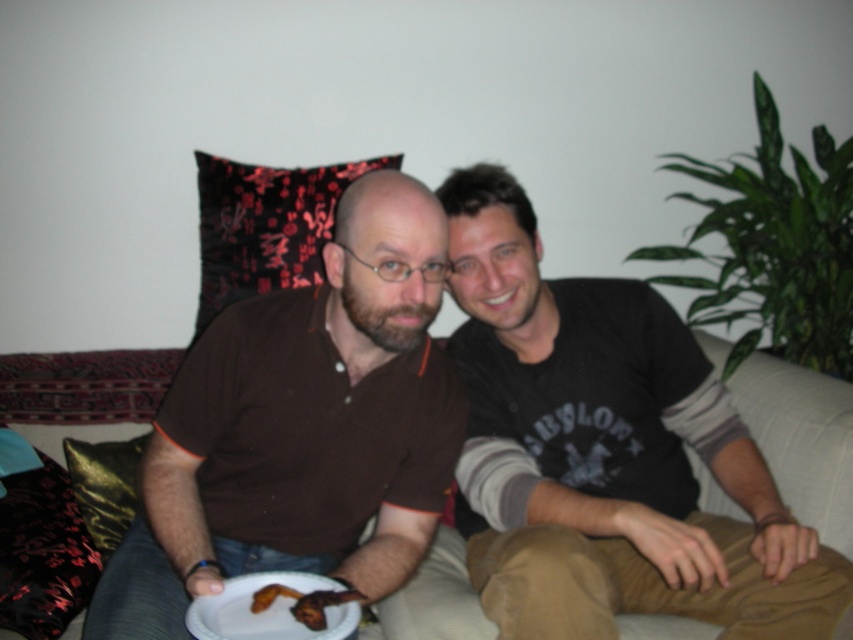
Which is above, white paper plate at lower center or gold shiny pillow at lower left?

Positioned higher is gold shiny pillow at lower left.

Based on the photo, between white paper plate at lower center and gold shiny pillow at lower left, which one appears on the right side from the viewer's perspective?

From the viewer's perspective, white paper plate at lower center appears more on the right side.

Between point (291, 577) and point (93, 524), which one is positioned behind?

The point (93, 524) is more distant.

This screenshot has width=853, height=640. I want to click on white paper plate at lower center, so click(268, 609).

Does brown cotton shirt at center appear on the left side of brown crispy fried food at lower center?

In fact, brown cotton shirt at center is to the right of brown crispy fried food at lower center.

Based on the photo, is brown cotton shirt at center positioned behind brown crispy fried food at lower center?

That is True.

In order to click on brown cotton shirt at center in this screenshot , I will do `click(608, 454)`.

Where is `brown cotton shirt at center`? brown cotton shirt at center is located at coordinates (608, 454).

Does brown matte shirt at center have a smaller size compared to gold shiny pillow at lower left?

No.

Is point (300, 342) more distant than point (126, 461)?

No, it is in front of (126, 461).

You are a GUI agent. You are given a task and a screenshot of the screen. Output one action in this format:
    pyautogui.click(x=<x>, y=<y>)
    Task: Click on the brown matte shirt at center
    This screenshot has width=853, height=640.
    Given the screenshot: What is the action you would take?
    pyautogui.click(x=300, y=428)